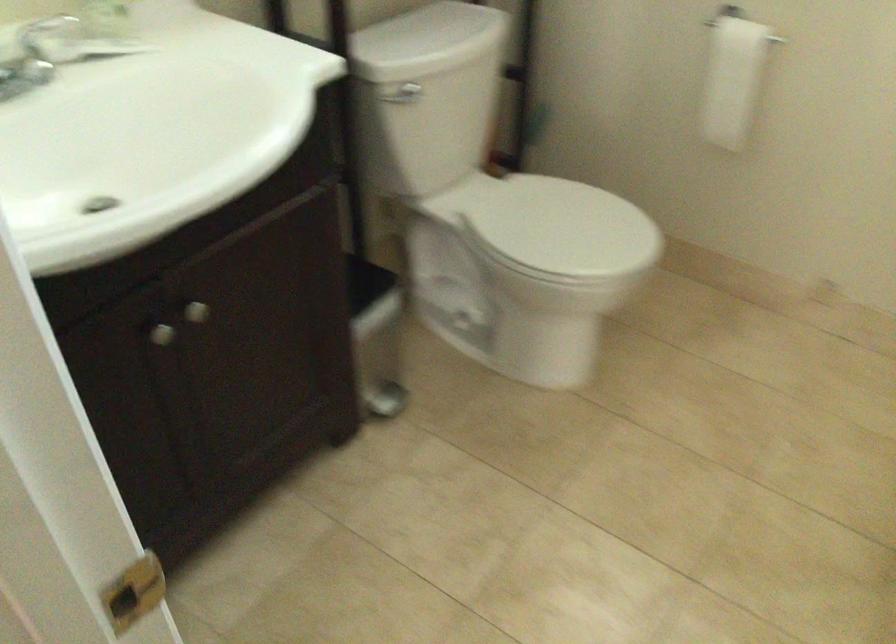
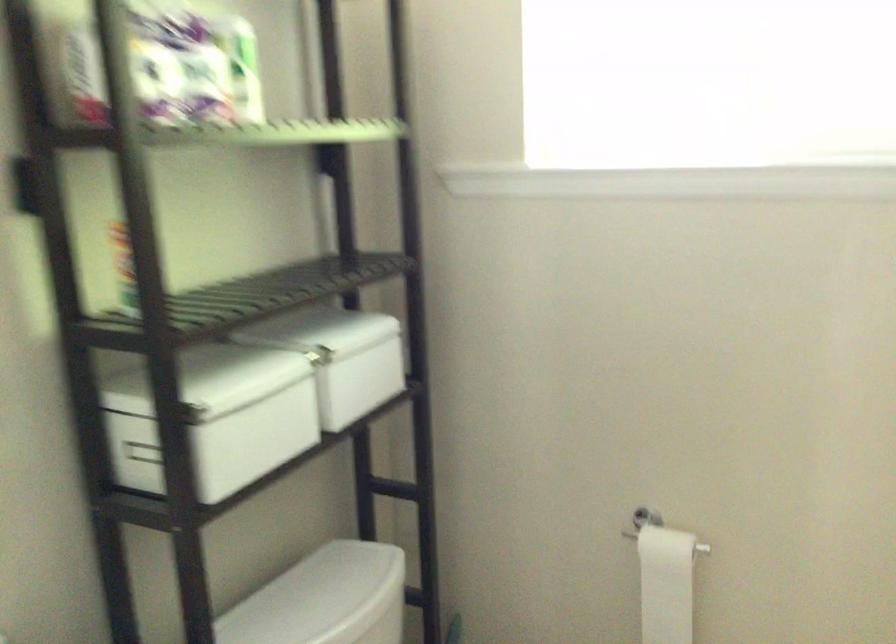
Question: How did the camera likely rotate?

Choices:
 (A) Left
 (B) Right
 (C) Up
 (D) Down

Answer: (C)